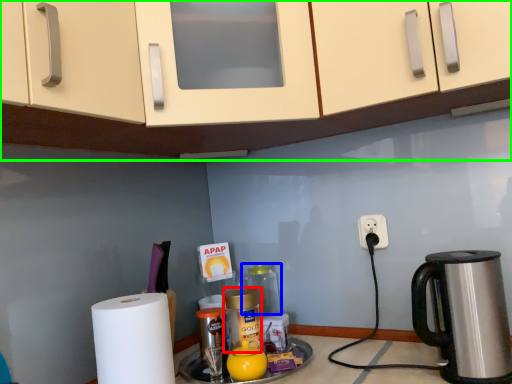
Question: Estimate the real-world distances between objects in this image. Which object is farther from bottle (highlighted by a red box), bottle (highlighted by a blue box) or cabinetry (highlighted by a green box)?

Choices:
 (A) bottle
 (B) cabinetry

Answer: (B)